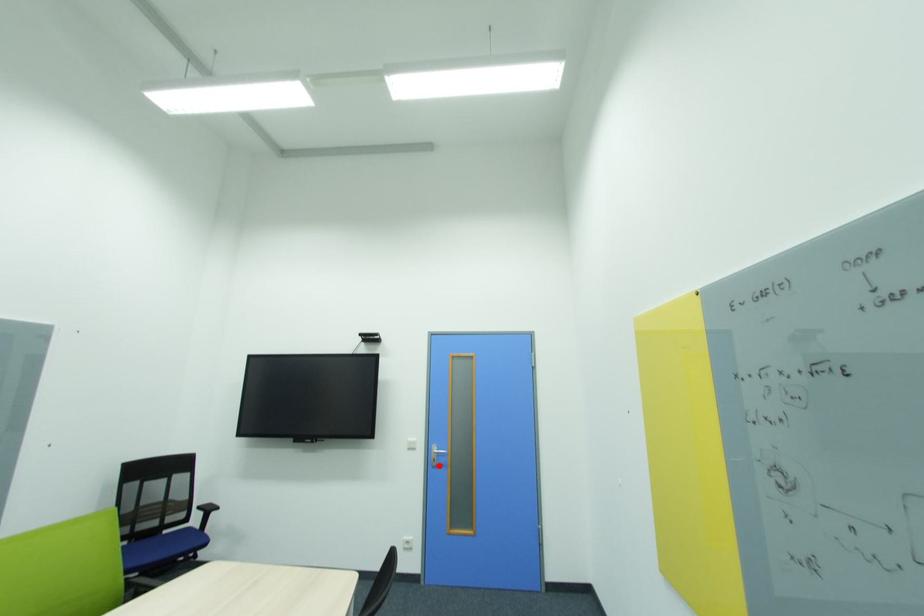
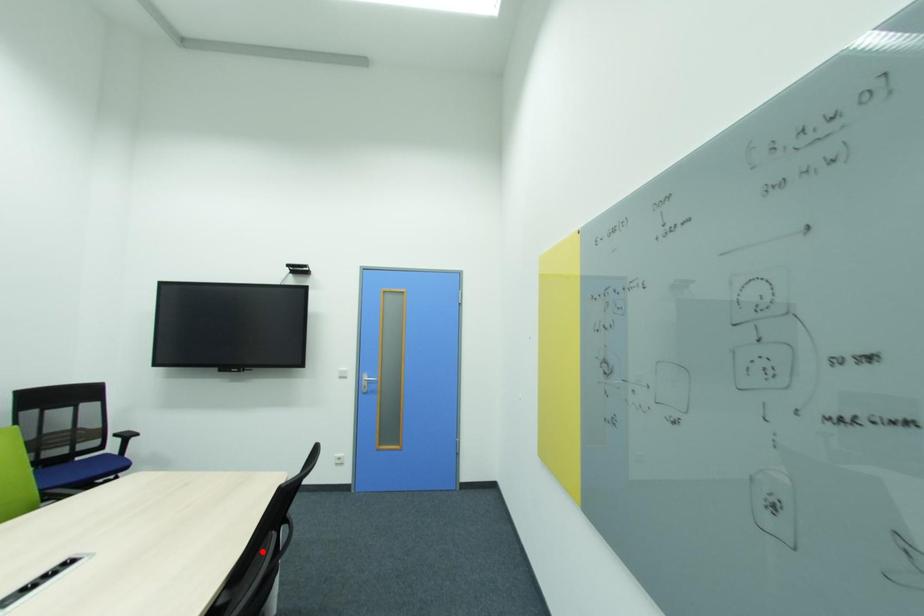
I am providing you with two images of the same scene from different viewpoints. A red point is marked on the first image and another point is marked on the second image. Is the red point in image1 aligned with the point shown in image2?

No